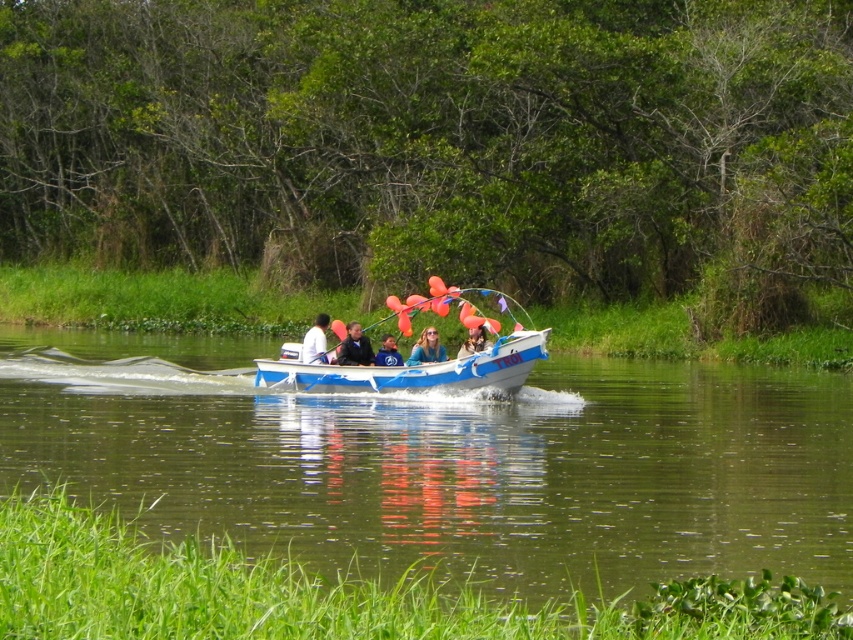
You are a photographer on the boat and want to take a photo of the dark blue suit at center and the matte blue shirt at center. Which one should you zoom in more on to capture details?

The dark blue suit at center is smaller than the matte blue shirt at center, so you should zoom in more on the dark blue suit at center to capture its details.

You are a passenger on the TROI motorboat and you want to know where your dark blue suit at center is located relative to your blue fabric shirt at center. Can you tell me?

The dark blue suit at center is to the left of the blue fabric shirt at center.